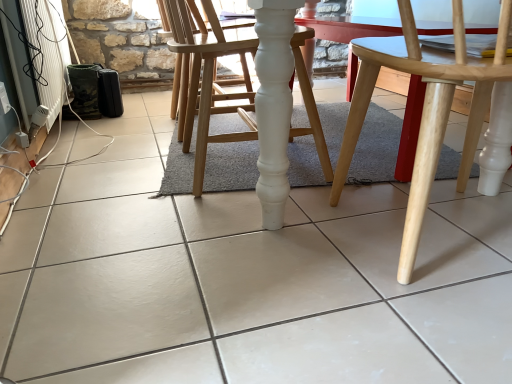
Locate an element on the screen. The image size is (512, 384). free space between natural wood chair at center, the second chair from the left, and white wood chair at center, which ranks as the 1th chair in left-to-right order is located at coordinates pos(314,213).